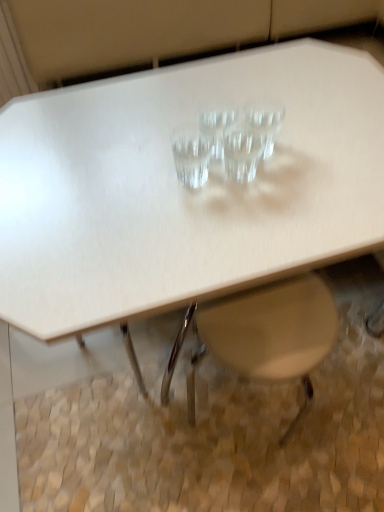
You are a GUI agent. You are given a task and a screenshot of the screen. Output one action in this format:
    pyautogui.click(x=<x>, y=<y>)
    Task: Click on the vacant space situated on the left part of transparent glass martini at center, which is the 2th martini glass from right to left
    The width and height of the screenshot is (384, 512).
    Given the screenshot: What is the action you would take?
    pyautogui.click(x=154, y=173)